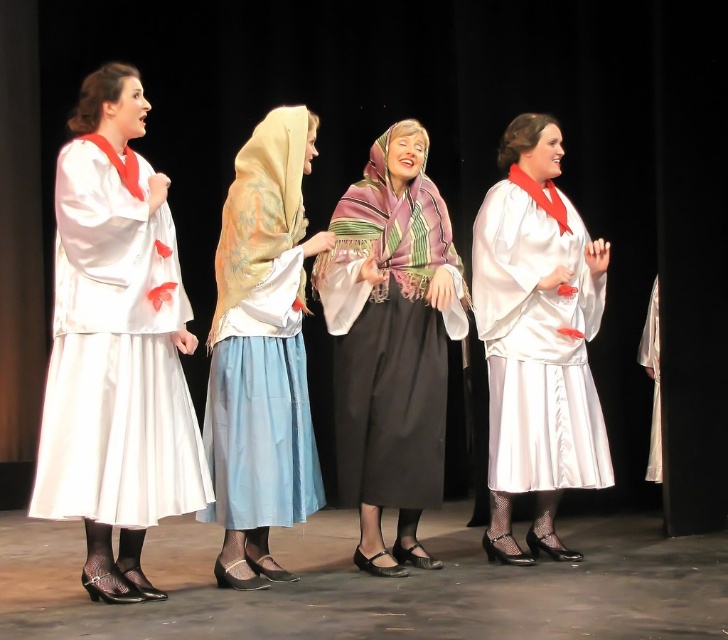
Question: Is multicolored woven scarf at center wider than silky beige scarf at center?

Choices:
 (A) no
 (B) yes

Answer: (B)

Question: Which point is farther from the camera taking this photo?

Choices:
 (A) (x=389, y=419)
 (B) (x=292, y=362)
 (C) (x=494, y=289)

Answer: (C)

Question: Which object is the farthest from the satin white dress at center?

Choices:
 (A) silky beige scarf at center
 (B) matte white dress at left

Answer: (B)

Question: Is matte white dress at left above satin white dress at center?

Choices:
 (A) no
 (B) yes

Answer: (B)

Question: Which of the following is the farthest from the observer?

Choices:
 (A) silky beige scarf at center
 (B) multicolored woven scarf at center
 (C) satin white dress at center

Answer: (C)

Question: Can you confirm if matte white dress at left is positioned above multicolored woven scarf at center?

Choices:
 (A) yes
 (B) no

Answer: (A)